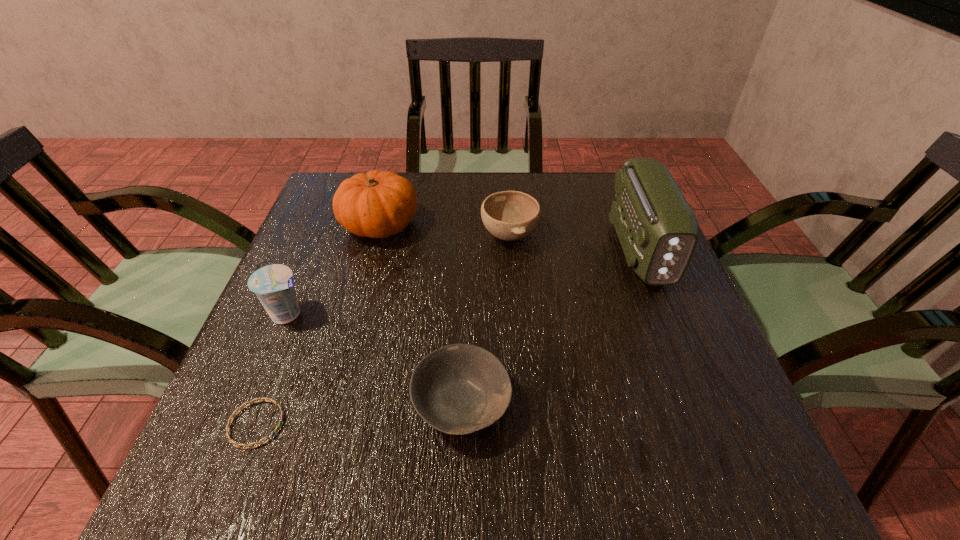
You are a GUI agent. You are given a task and a screenshot of the screen. Output one action in this format:
    pyautogui.click(x=<x>, y=<y>)
    Task: Click on the tallest object
    This screenshot has width=960, height=540.
    Given the screenshot: What is the action you would take?
    pyautogui.click(x=658, y=231)

Find the location of a particular element. Image resolution: width=960 pixels, height=540 pixels. the rightmost object is located at coordinates (658, 231).

Where is `pumpkin`? The height and width of the screenshot is (540, 960). pumpkin is located at coordinates (377, 204).

This screenshot has width=960, height=540. I want to click on yogurt, so click(x=273, y=284).

Where is `the third nearest object`? This screenshot has height=540, width=960. the third nearest object is located at coordinates (273, 284).

Where is `the farther bowl`? The width and height of the screenshot is (960, 540). the farther bowl is located at coordinates (508, 215).

Locate an element on the screen. This screenshot has width=960, height=540. the taller bowl is located at coordinates (508, 215).

Locate an element on the screen. Image resolution: width=960 pixels, height=540 pixels. the nearer bowl is located at coordinates (458, 389).

At what (x,y) coordinates should I click in order to perform the action: click on the shorter bowl. Please return your answer as a coordinate pair (x, y). Looking at the image, I should click on (458, 389).

Locate an element on the screen. The height and width of the screenshot is (540, 960). bracelet is located at coordinates (232, 441).